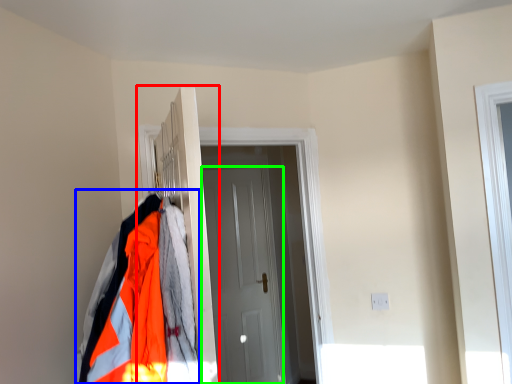
Question: Estimate the real-world distances between objects in this image. Which object is farther from closet (highlighted by a red box), jacket (highlighted by a blue box) or door (highlighted by a green box)?

Choices:
 (A) jacket
 (B) door

Answer: (B)